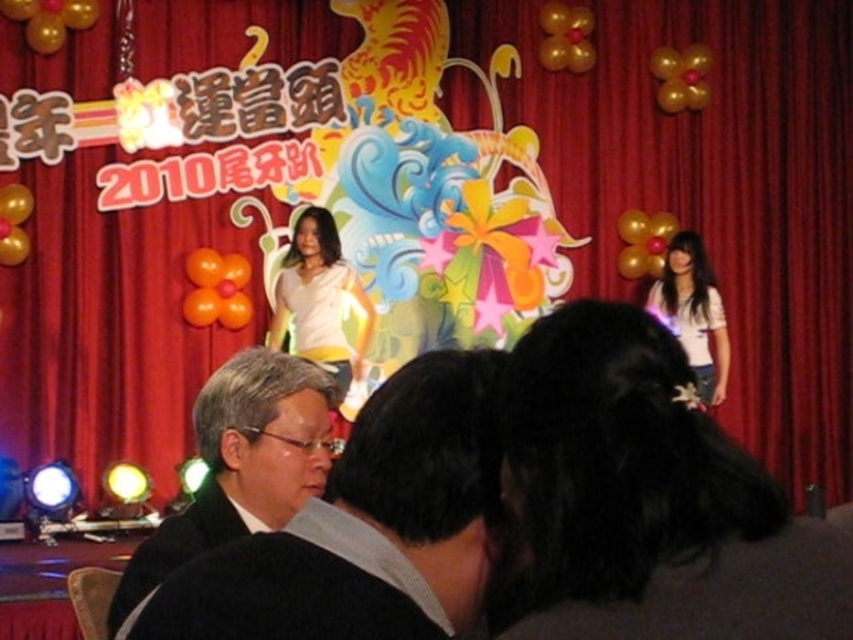
You are a photographer at the event and need to capture a photo that includes both the black matte suit at lower left and the white matte shirt at right. Based on their positions, which one is positioned higher in the frame?

The black matte suit at lower left is positioned higher in the frame than the white matte shirt at right.